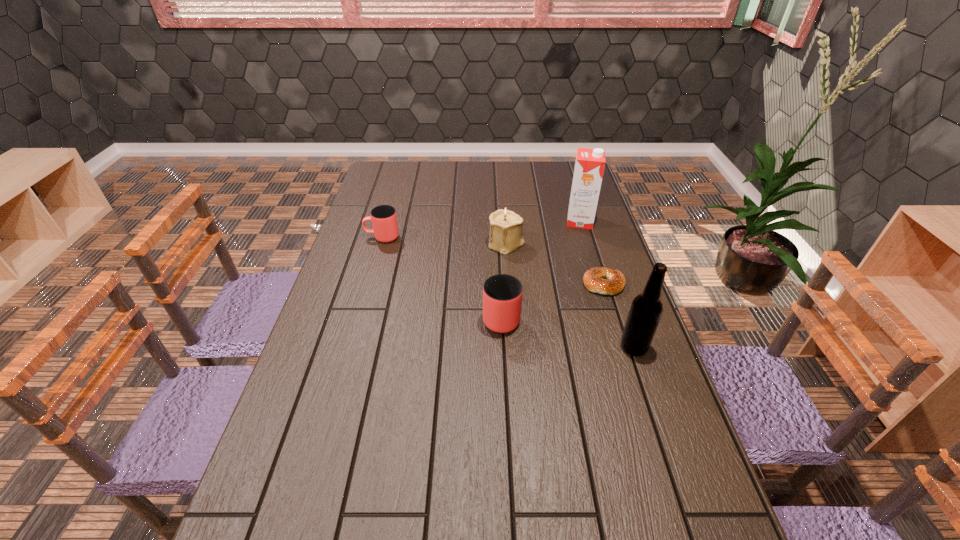
You are a GUI agent. You are given a task and a screenshot of the screen. Output one action in this format:
    pyautogui.click(x=<x>, y=<y>)
    Task: Click on the free space between the beer bottle and the third nearest object
    The height and width of the screenshot is (540, 960).
    Given the screenshot: What is the action you would take?
    pyautogui.click(x=619, y=316)

What are the coordinates of `blank region between the second shortest object and the carton` in the screenshot? It's located at pyautogui.click(x=481, y=229).

This screenshot has width=960, height=540. In order to click on empty space that is in between the fifth tallest object and the right cup in this screenshot , I will do `click(442, 276)`.

I want to click on vacant area that lies between the candle_holder and the farthest object, so click(543, 233).

You are a GUI agent. You are given a task and a screenshot of the screen. Output one action in this format:
    pyautogui.click(x=<x>, y=<y>)
    Task: Click on the object that is the nearest to the leftmost object
    The image size is (960, 540).
    Given the screenshot: What is the action you would take?
    pyautogui.click(x=506, y=227)

Select which object appears as the second closest to the farthest object. Please provide its 2D coordinates. Your answer should be formatted as a tuple, i.e. [(x, y)], where the tuple contains the x and y coordinates of a point satisfying the conditions above.

[(593, 280)]

Locate an element on the screen. The width and height of the screenshot is (960, 540). vacant space that satisfies the following two spatial constraints: 1. on the front side of the candle_holder; 2. on the right side of the nearest object is located at coordinates (514, 347).

At what (x,y) coordinates should I click in order to perform the action: click on free space that satisfies the following two spatial constraints: 1. on the handle side of the taller cup; 2. on the left side of the candle_holder. Please return your answer as a coordinate pair (x, y). The height and width of the screenshot is (540, 960). Looking at the image, I should click on (497, 244).

The width and height of the screenshot is (960, 540). In order to click on free region that satisfies the following two spatial constraints: 1. on the handle side of the farthest object; 2. on the right side of the second nearest object in this screenshot , I will do `click(496, 221)`.

The height and width of the screenshot is (540, 960). I want to click on vacant space that satisfies the following two spatial constraints: 1. on the handle side of the taller cup; 2. on the left side of the shortest object, so click(499, 285).